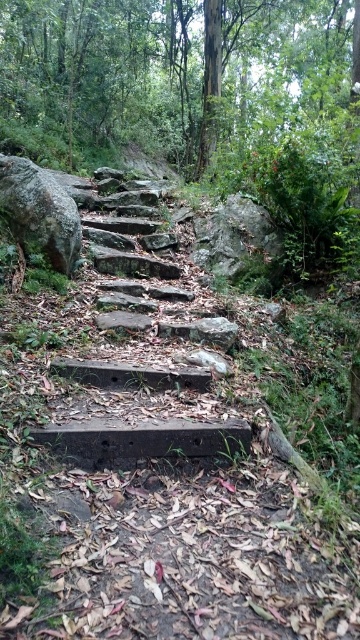
Question: Which object is closer to the camera taking this photo?

Choices:
 (A) gray rough rock at center
 (B) rough gray rock at left
 (C) green leafy tree at upper center
 (D) brown concrete stairs at center

Answer: (D)

Question: Observing the image, what is the correct spatial positioning of rough gray rock at left in reference to gray rough rock at center?

Choices:
 (A) right
 (B) left

Answer: (B)

Question: Can you confirm if brown concrete stairs at center is thinner than gray rough rock at center?

Choices:
 (A) yes
 (B) no

Answer: (B)

Question: Is concrete stairs at center below brown concrete stairs at center?

Choices:
 (A) yes
 (B) no

Answer: (B)

Question: Which is farther from the brown concrete stairs at center?

Choices:
 (A) green leafy tree at upper center
 (B) rough gray rock at left
 (C) concrete stairs at center

Answer: (A)

Question: Which point is farther to the camera?

Choices:
 (A) concrete stairs at center
 (B) rough gray rock at left
 (C) gray rough rock at center

Answer: (C)